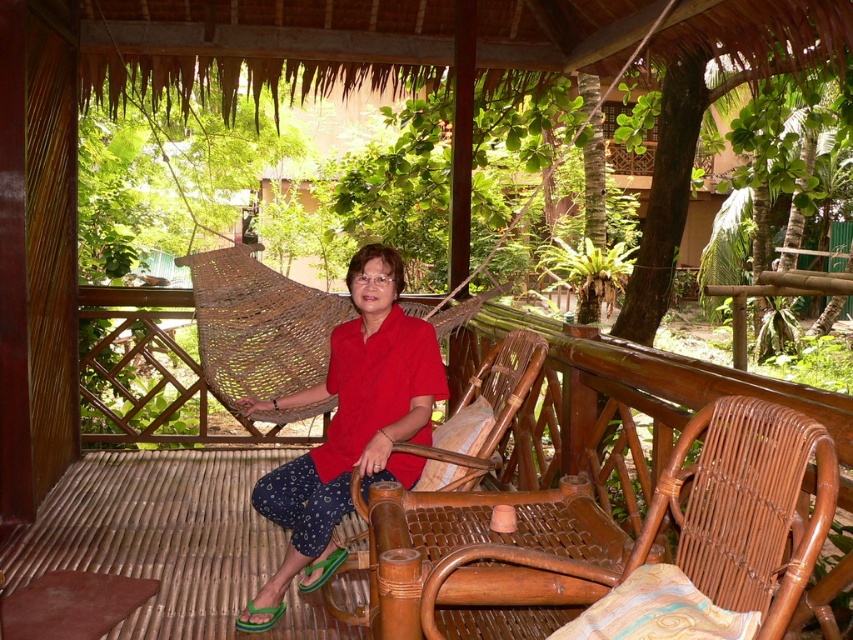
Between point (784, 518) and point (257, 401), which one is positioned in front?

Point (784, 518)

Based on the photo, can you confirm if brown wicker rocking chair at center is positioned above red matte shirt at center?

No.

Which is behind, point (448, 621) or point (341, 465)?

The point (341, 465) is more distant.

At what (x,y) coordinates should I click in order to perform the action: click on brown wicker rocking chair at center. Please return your answer as a coordinate pair (x, y). Looking at the image, I should click on (693, 525).

Does red matte shirt at center appear under woven bamboo chair at center?

Correct, red matte shirt at center is located below woven bamboo chair at center.

Can you confirm if red matte shirt at center is wider than woven bamboo chair at center?

Yes.

Where is `red matte shirt at center`? red matte shirt at center is located at coordinates (350, 428).

Where is `red matte shirt at center`? The image size is (853, 640). red matte shirt at center is located at coordinates (350, 428).

Does brown wicker rocking chair at center have a lesser height compared to woven bamboo chair at center?

Correct, brown wicker rocking chair at center is not as tall as woven bamboo chair at center.

Which is more to the left, brown wicker rocking chair at center or woven bamboo chair at center?

From the viewer's perspective, woven bamboo chair at center appears more on the left side.

Image resolution: width=853 pixels, height=640 pixels. I want to click on brown wicker rocking chair at center, so click(x=693, y=525).

Locate an element on the screen. This screenshot has height=640, width=853. brown wicker rocking chair at center is located at coordinates (693, 525).